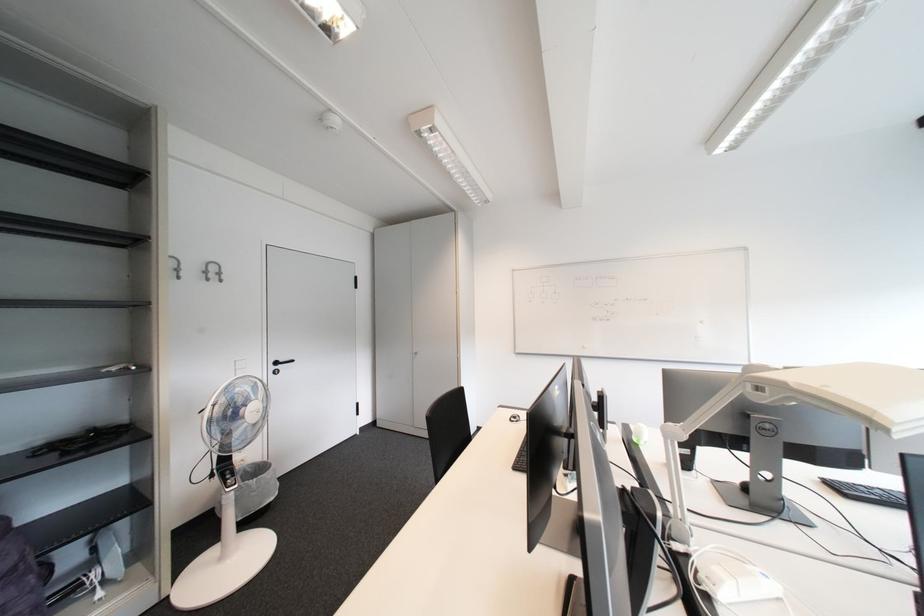
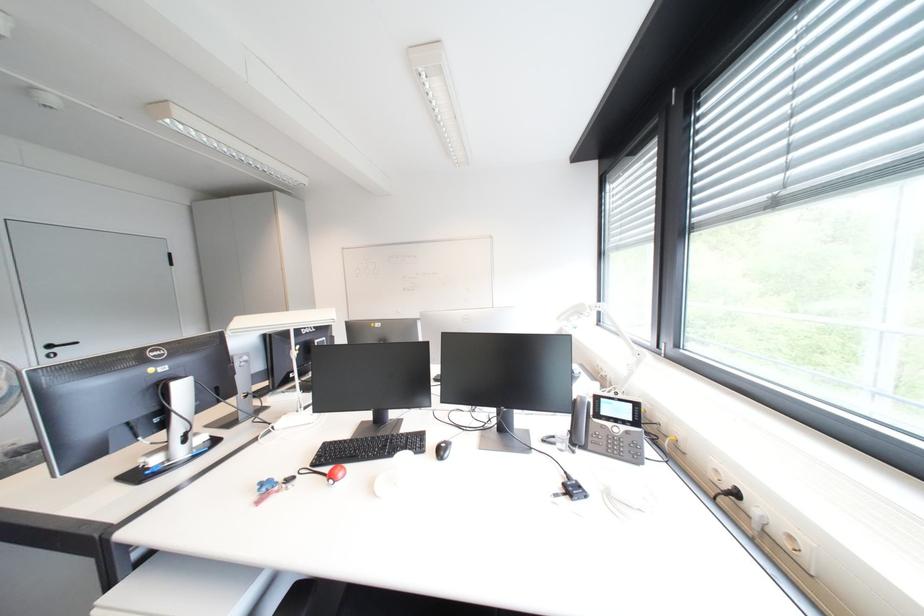
What movement of the cameraman would produce the second image?

The cameraman moved toward right, backward.